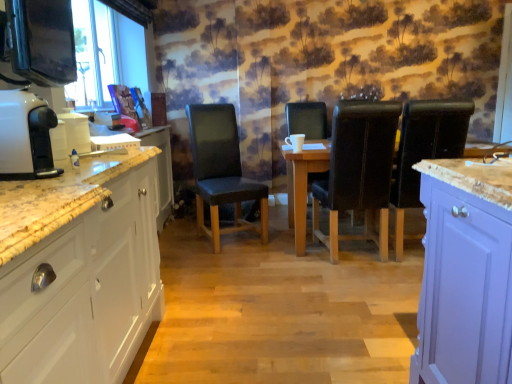
Question: Do you think leather at center, which is counted as the second chair, starting from the right, is within black leather chair at center, which appears as the 3th chair when viewed from the right, or outside of it?

Choices:
 (A) inside
 (B) outside

Answer: (B)

Question: From the image's perspective, is leather at center, which is counted as the second chair, starting from the right, positioned above or below black leather chair at center, which appears as the 3th chair when viewed from the right?

Choices:
 (A) above
 (B) below

Answer: (B)

Question: Which is nearer to the white glossy cabinet at left?

Choices:
 (A) black leather chair at center, which appears as the 3th chair when viewed from the right
 (B) white glossy coffee machine at left
 (C) leather at center, which is the 3th chair from left to right
 (D) wooden table at center
 (E) leather-like black chair at center-left, which appears as the fourth chair when viewed from the right

Answer: (B)

Question: Which object is positioned farthest from the black leather chair at right, the first chair in the right-to-left sequence?

Choices:
 (A) wooden table at center
 (B) leather-like black chair at center-left, which appears as the fourth chair when viewed from the right
 (C) white glossy cabinet at left
 (D) leather at center, which is the 3th chair from left to right
 (E) black leather chair at center, the 2th chair from the left

Answer: (C)